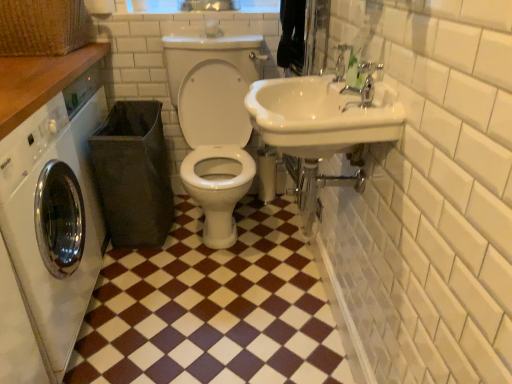
Locate an element on the screen. This screenshot has height=384, width=512. space that is in front of white glossy toilet at center is located at coordinates (216, 297).